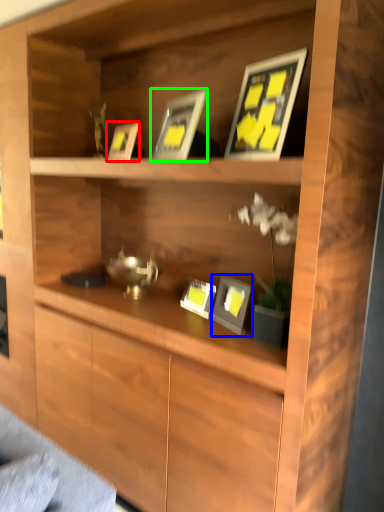
Question: Estimate the real-world distances between objects in this image. Which object is farther from picture frame (highlighted by a red box), picture frame (highlighted by a blue box) or picture frame (highlighted by a green box)?

Choices:
 (A) picture frame
 (B) picture frame

Answer: (A)